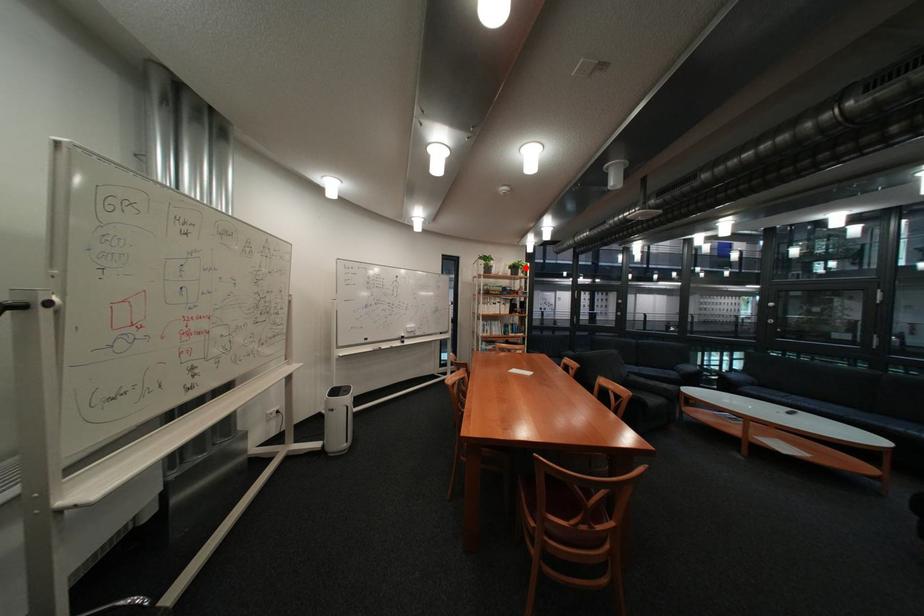
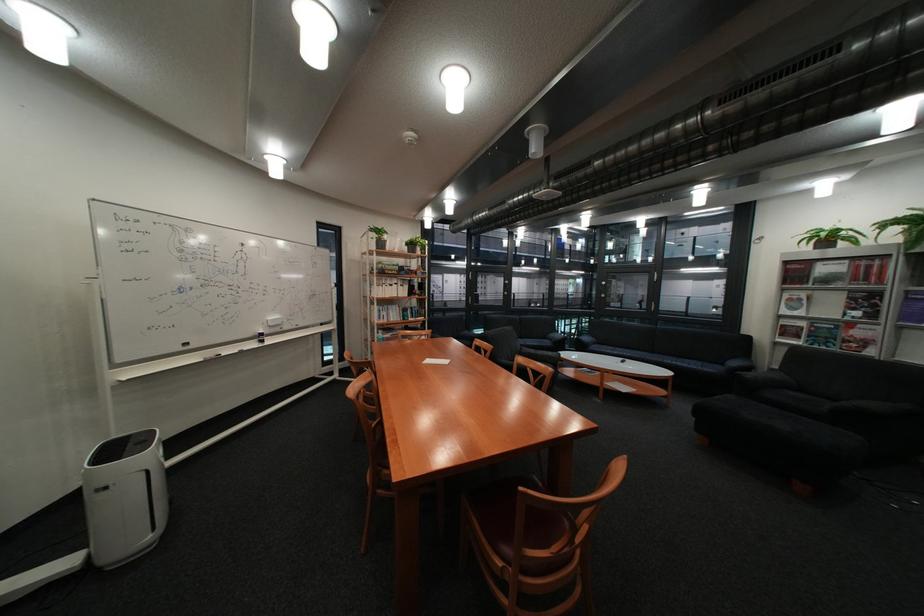
Question: I am providing you with two images of the same scene from different viewpoints. A red point is marked on the first image. At the location where the point appears in image 1, is it still visible in image 2?

Choices:
 (A) Yes
 (B) No

Answer: (A)